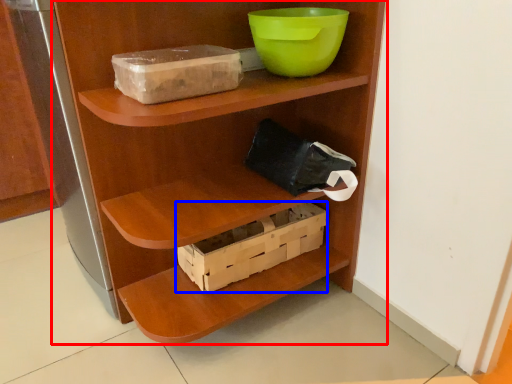
Question: Which of the following is the closest to the observer, shelf (highlighted by a red box) or box (highlighted by a blue box)?

Choices:
 (A) shelf
 (B) box

Answer: (A)